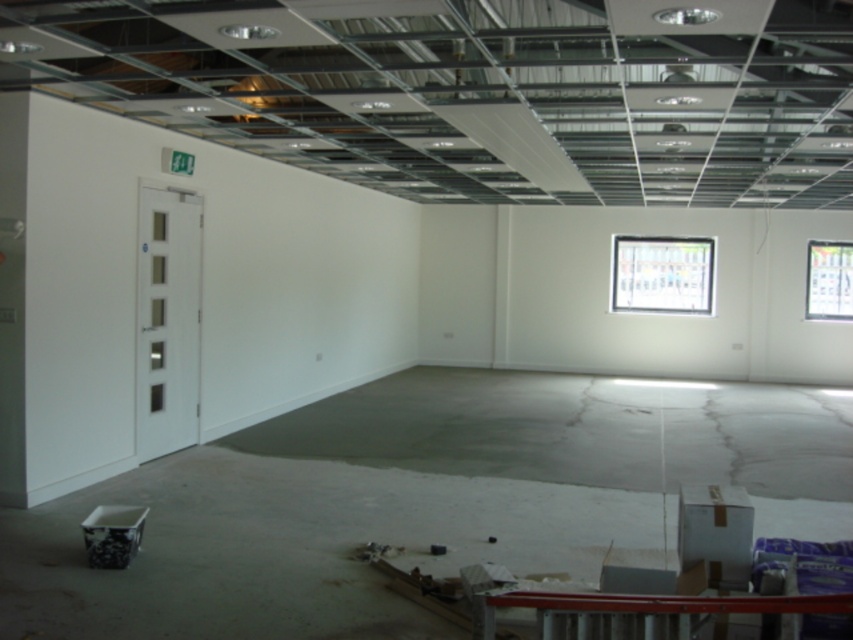
You are an interior designer assessing the room layout. You need to determine which transparent glass window is wider between the transparent glass window at upper center and the transparent glass window at upper right. Based on the description provided, which window is wider?

The transparent glass window at upper center is wider than the transparent glass window at upper right according to the description.

You are standing in the construction site and see two points marked in the room. Which point is closer to you, point [611,273] or point [817,262]?

Point [611,273] is further to the viewer than point [817,262], so point [817,262] is closer to you.

Consider the image. You are an interior designer assessing the room for safety regulations. You need to ensure that all windows meet the minimum height requirement of 1.8 meters. Given that the transparent glass window at upper center is taller than the transparent glass window at upper right, which window might not comply with the regulation?

The transparent glass window at upper right might not comply with the regulation since it is shorter than the transparent glass window at upper center, which has a greater height.